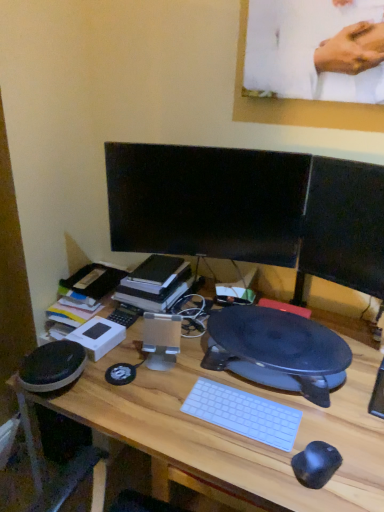
Question: Considering the relative sizes of black glossy monitor at center, arranged as the first computer monitor when viewed from the left, and hardcover book at center in the image provided, is black glossy monitor at center, arranged as the first computer monitor when viewed from the left, smaller than hardcover book at center?

Choices:
 (A) no
 (B) yes

Answer: (A)

Question: From the image's perspective, does black glossy monitor at center, arranged as the first computer monitor when viewed from the left, appear lower than hardcover book at center?

Choices:
 (A) no
 (B) yes

Answer: (A)

Question: From a real-world perspective, is black glossy monitor at center, arranged as the first computer monitor when viewed from the left, located higher than hardcover book at center?

Choices:
 (A) no
 (B) yes

Answer: (B)

Question: Are black glossy monitor at center, which is the 2th computer monitor in right-to-left order, and hardcover book at center making contact?

Choices:
 (A) yes
 (B) no

Answer: (B)

Question: Is the depth of black glossy monitor at center, arranged as the first computer monitor when viewed from the left, less than that of hardcover book at center?

Choices:
 (A) no
 (B) yes

Answer: (B)

Question: In terms of size, does hardcover book at center appear bigger or smaller than wooden desk at center?

Choices:
 (A) small
 (B) big

Answer: (A)

Question: Is point (168, 257) positioned closer to the camera than point (205, 454)?

Choices:
 (A) closer
 (B) farther

Answer: (B)

Question: From the image's perspective, is hardcover book at center above or below wooden desk at center?

Choices:
 (A) above
 (B) below

Answer: (A)

Question: Is hardcover book at center to the left or to the right of wooden desk at center in the image?

Choices:
 (A) right
 (B) left

Answer: (B)

Question: In terms of width, does black glossy monitor at center, arranged as the first computer monitor when viewed from the left, look wider or thinner when compared to hardcover book at center?

Choices:
 (A) wide
 (B) thin

Answer: (B)

Question: Is point (175, 146) positioned closer to the camera than point (167, 273)?

Choices:
 (A) farther
 (B) closer

Answer: (B)

Question: Visually, is black glossy monitor at center, arranged as the first computer monitor when viewed from the left, positioned to the left or to the right of hardcover book at center?

Choices:
 (A) right
 (B) left

Answer: (A)

Question: From the image's perspective, relative to hardcover book at center, is black glossy monitor at center, arranged as the first computer monitor when viewed from the left, above or below?

Choices:
 (A) above
 (B) below

Answer: (A)

Question: Looking at their shapes, would you say wooden desk at center is wider or thinner than black glossy monitor at center, which is the 2th computer monitor in right-to-left order?

Choices:
 (A) wide
 (B) thin

Answer: (A)

Question: Considering the positions of wooden desk at center and black glossy monitor at center, which is the 2th computer monitor in right-to-left order, in the image, is wooden desk at center bigger or smaller than black glossy monitor at center, which is the 2th computer monitor in right-to-left order,?

Choices:
 (A) small
 (B) big

Answer: (B)